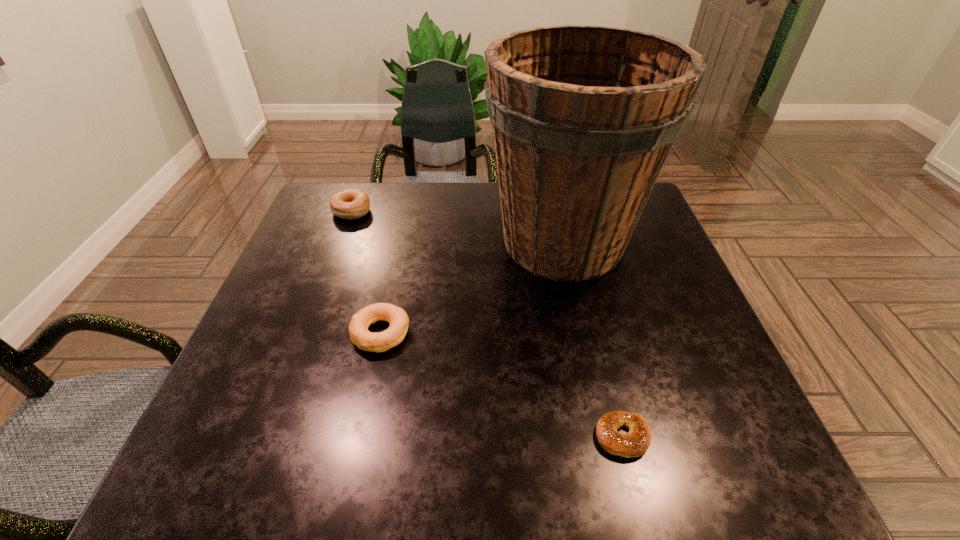
Image resolution: width=960 pixels, height=540 pixels. In order to click on the tallest object in this screenshot , I will do `click(583, 117)`.

Locate an element on the screen. the second tallest object is located at coordinates (350, 203).

Locate an element on the screen. This screenshot has width=960, height=540. the leftmost bagel is located at coordinates (350, 203).

At what (x,y) coordinates should I click in order to perform the action: click on the second bagel from left to right. Please return your answer as a coordinate pair (x, y). Looking at the image, I should click on (365, 340).

The height and width of the screenshot is (540, 960). What are the coordinates of `the second tallest bagel` in the screenshot? It's located at (365, 340).

Where is `the shortest bagel`? Image resolution: width=960 pixels, height=540 pixels. the shortest bagel is located at coordinates (633, 444).

Where is `the nearest bagel`? The image size is (960, 540). the nearest bagel is located at coordinates (633, 444).

Identify the location of vacant space positioned on the left of the tallest object. (429, 241).

Image resolution: width=960 pixels, height=540 pixels. Identify the location of blank area located on the right of the leftmost object. (424, 212).

Find the location of a particular element. The image size is (960, 540). vacant region located on the right of the third farthest object is located at coordinates (600, 333).